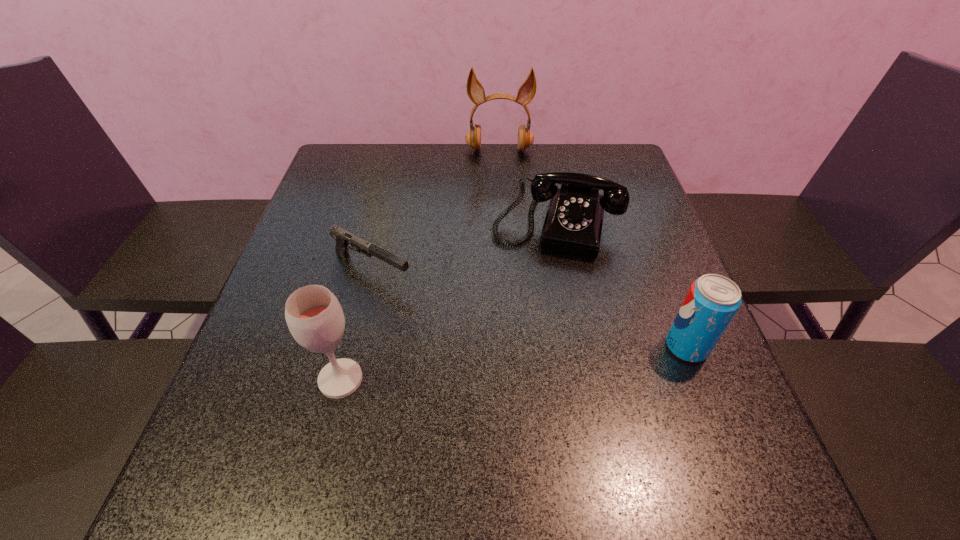
I want to click on vacant position in the image that satisfies the following two spatial constraints: 1. on the back side of the tallest object; 2. on the right side of the wineglass, so click(x=397, y=151).